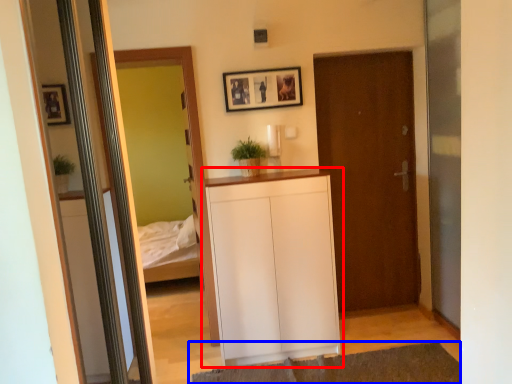
Question: Among these objects, which one is farthest to the camera, cabinetry (highlighted by a red box) or plain (highlighted by a blue box)?

Choices:
 (A) cabinetry
 (B) plain

Answer: (A)